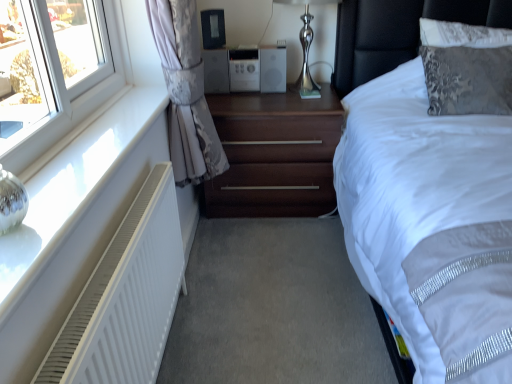
Question: From a real-world perspective, relative to white matte radiator at left, is black plastic speaker at upper center vertically above or below?

Choices:
 (A) below
 (B) above

Answer: (B)

Question: In terms of height, does black plastic speaker at upper center look taller or shorter compared to white matte radiator at left?

Choices:
 (A) short
 (B) tall

Answer: (A)

Question: Which of these objects is positioned farthest from the white matte radiator at lower left?

Choices:
 (A) black leather headboard at upper right
 (B) silver metallic stereo at center
 (C) white matte radiator at left
 (D) silky gray curtain at left
 (E) black plastic speaker at upper center

Answer: (A)

Question: Which object is positioned closest to the white matte radiator at lower left?

Choices:
 (A) shiny metallic table lamp at upper center
 (B) white matte radiator at left
 (C) black leather headboard at upper right
 (D) dark wood nightstand at center
 (E) silky gray curtain at left

Answer: (B)